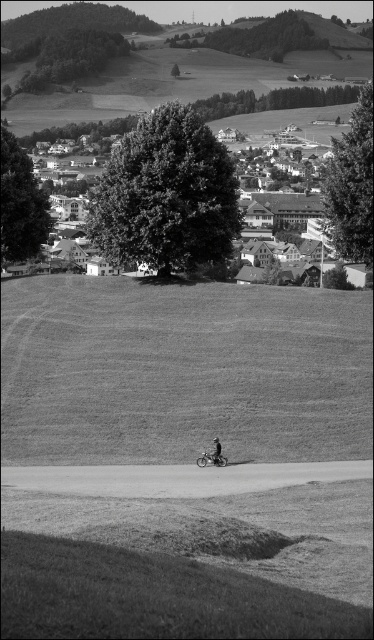
You are standing at the point marked as point (178, 486) in the image. A friend is located 45.47 meters away from you in the direction of the viewer. Can you see your friend? Explain why or why not based on the scene description.

Yes, you can see your friend because the scene is a serene rural landscape with a wide expanse of grassy terrain, no obstructions between you and the viewer direction, and the distance matches the given 45.47 meters.